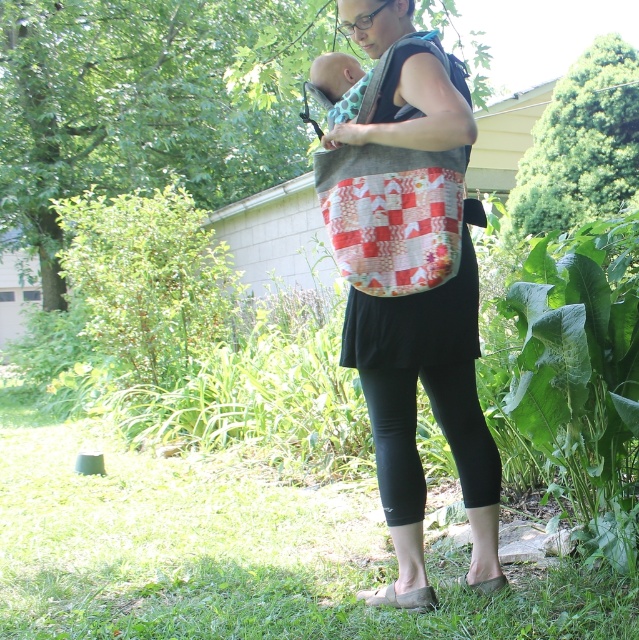
Does patchwork fabric bag at center appear over black stretchy leggings at lower center?

Yes, patchwork fabric bag at center is above black stretchy leggings at lower center.

Is point (378, 80) in front of point (452, 426)?

Yes, it is.

Where is `patchwork fabric bag at center`? The width and height of the screenshot is (639, 640). patchwork fabric bag at center is located at coordinates (390, 214).

How distant is quilted fabric bag at center from patchwork fabric bag at center?

They are 19.72 inches apart.

Can you confirm if quilted fabric bag at center is positioned to the left of patchwork fabric bag at center?

Incorrect, quilted fabric bag at center is not on the left side of patchwork fabric bag at center.

Between point (394, 68) and point (358, 212), which one is positioned behind?

The point (394, 68) is behind.

At what (x,y) coordinates should I click in order to perform the action: click on quilted fabric bag at center. Please return your answer as a coordinate pair (x, y). Looking at the image, I should click on (433, 416).

Who is taller, quilted fabric bag at center or black stretchy leggings at lower center?

Standing taller between the two is quilted fabric bag at center.

Consider the image. Which is more to the right, quilted fabric bag at center or black stretchy leggings at lower center?

black stretchy leggings at lower center is more to the right.

Is point (433, 337) positioned in front of point (381, 406)?

Yes, it is.

The height and width of the screenshot is (640, 639). What are the coordinates of `quilted fabric bag at center` in the screenshot? It's located at (433, 416).